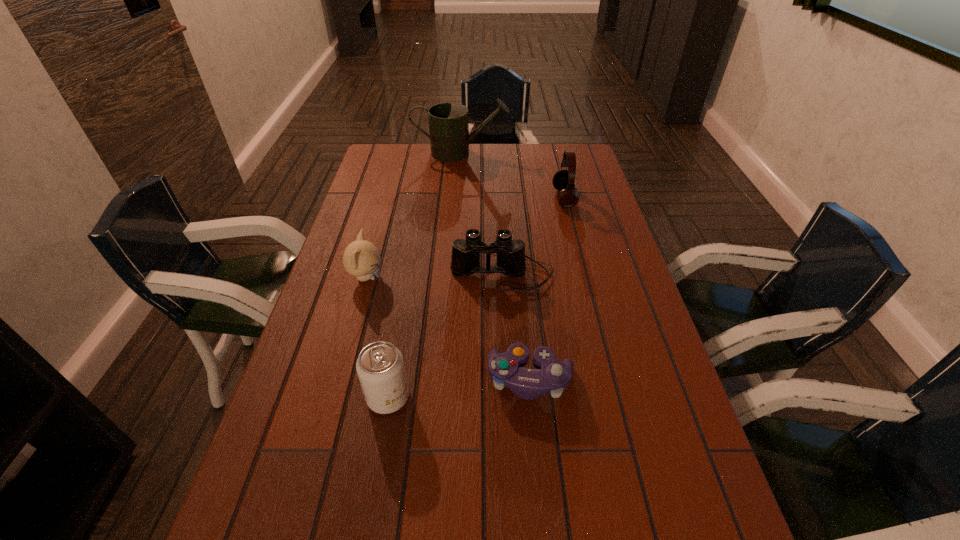
Where is `the tallest object`? The width and height of the screenshot is (960, 540). the tallest object is located at coordinates (449, 136).

The image size is (960, 540). Identify the location of watering can. (449, 136).

The height and width of the screenshot is (540, 960). What are the coordinates of `the rightmost object` in the screenshot? It's located at (568, 196).

Find the location of `headset`. headset is located at coordinates (568, 196).

The width and height of the screenshot is (960, 540). Find the location of `soda can`. soda can is located at coordinates pyautogui.click(x=380, y=366).

Find the location of `binoculars`. binoculars is located at coordinates (465, 260).

At what (x,y) coordinates should I click in order to perform the action: click on the leftmost object. Please return your answer as a coordinate pair (x, y). Looking at the image, I should click on (361, 258).

Where is `the shortest object`? The image size is (960, 540). the shortest object is located at coordinates (551, 376).

Locate an element on the screen. The width and height of the screenshot is (960, 540). vacant region located with the spout on the tallest object is located at coordinates (553, 153).

Find the location of a particular element. The image size is (960, 540). vacant space located on the ear pads of the headset is located at coordinates (539, 198).